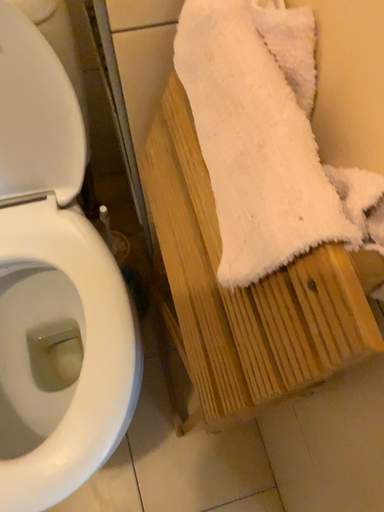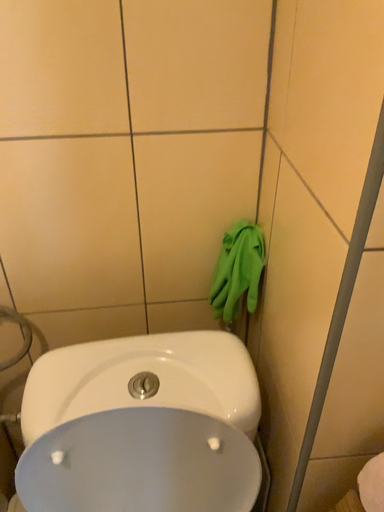
Question: How did the camera likely rotate when shooting the video?

Choices:
 (A) rotated downward
 (B) rotated upward

Answer: (B)